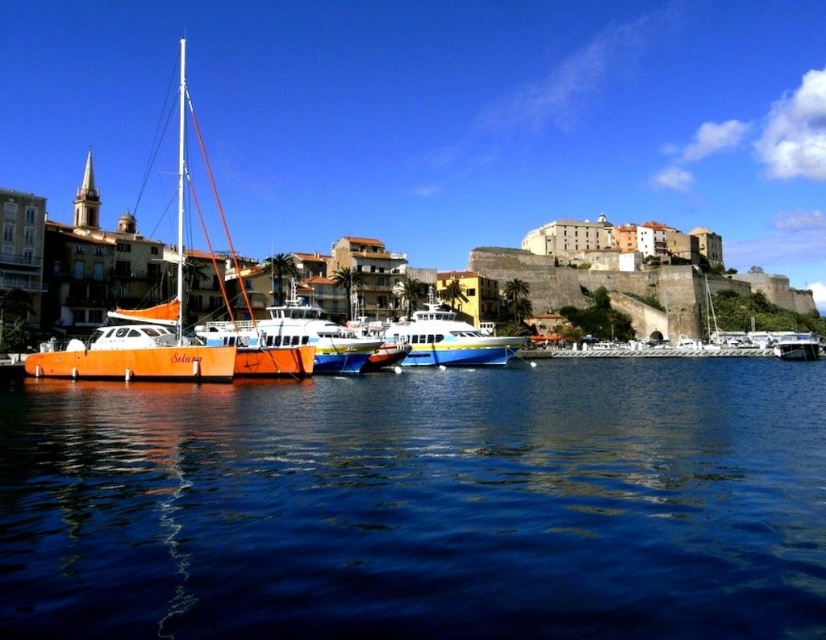
Between orange matte sailboat at left and white glossy yacht at center, which one has less height?

white glossy yacht at center is shorter.

Which is in front, point (98, 356) or point (273, 346)?

Point (98, 356) is more forward.

Consider the image. Who is more distant from viewer, (169, 368) or (336, 342)?

Positioned behind is point (336, 342).

Where is `orange matte sailboat at left`? Image resolution: width=826 pixels, height=640 pixels. orange matte sailboat at left is located at coordinates (165, 326).

Is blue liquid water at lower center further to camera compared to blue glossy boat at center?

No.

Which is below, blue liquid water at lower center or blue glossy boat at center?

blue liquid water at lower center is below.

Where is `blue liquid water at lower center`? The image size is (826, 640). blue liquid water at lower center is located at coordinates (421, 506).

Locate an element on the screen. Image resolution: width=826 pixels, height=640 pixels. blue liquid water at lower center is located at coordinates (421, 506).

Based on the photo, who is positioned more to the left, blue liquid water at lower center or matte orange boat at left?

matte orange boat at left

Does point (563, 476) come farther from viewer compared to point (98, 294)?

No, it is in front of (98, 294).

Is point (795, 440) positioned in front of point (687, 326)?

Yes, it is in front of point (687, 326).

The width and height of the screenshot is (826, 640). I want to click on blue liquid water at lower center, so click(x=421, y=506).